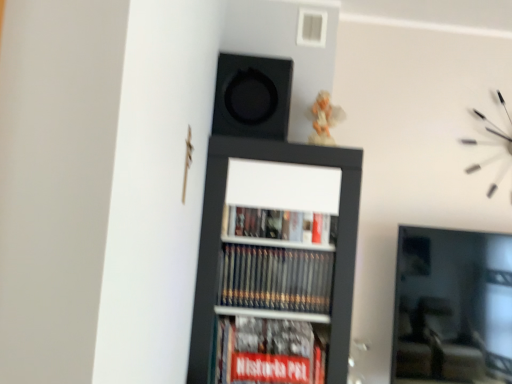
Measure the distance between point (501, 146) and camera.

A distance of 2.11 meters exists between point (501, 146) and camera.

The image size is (512, 384). In order to click on black matte speaker at upper center in this screenshot , I will do `click(252, 96)`.

What do you see at coordinates (275, 261) in the screenshot?
I see `black matte bookcase at center` at bounding box center [275, 261].

Identify the location of white matte clock at upper right. The width and height of the screenshot is (512, 384). (495, 144).

From the image's perspective, is white matte clock at upper right located above or below black matte bookcase at center?

white matte clock at upper right is above black matte bookcase at center.

Which is more to the left, white matte clock at upper right or black matte bookcase at center?

black matte bookcase at center.

Which of these two, white matte clock at upper right or black matte bookcase at center, stands taller?

black matte bookcase at center is taller.

Can you confirm if black matte speaker at upper center is positioned to the right of white matte clock at upper right?

No, black matte speaker at upper center is not to the right of white matte clock at upper right.

Choose the correct answer: Is black matte speaker at upper center inside white matte clock at upper right or outside it?

black matte speaker at upper center is spatially situated outside white matte clock at upper right.

Between black matte speaker at upper center and white matte clock at upper right, which one has larger size?

black matte speaker at upper center is bigger.

From the image's perspective, which one is positioned higher, black matte speaker at upper center or white matte clock at upper right?

black matte speaker at upper center is shown above in the image.

Are white matte clock at upper right and black matte speaker at upper center far apart?

Indeed, white matte clock at upper right is not near black matte speaker at upper center.

From the picture: Who is shorter, white matte clock at upper right or black matte speaker at upper center?

With less height is black matte speaker at upper center.

From a real-world perspective, is white matte clock at upper right physically below black matte speaker at upper center?

Yes, from a real-world perspective, white matte clock at upper right is below black matte speaker at upper center.

Is point (487, 125) farther from camera compared to point (250, 106)?

Yes, point (487, 125) is farther from viewer.

Is white matte clock at upper right located within black matte bookcase at center?

No, white matte clock at upper right is not inside black matte bookcase at center.

Is black matte bookcase at center smaller than white matte clock at upper right?

Incorrect, black matte bookcase at center is not smaller in size than white matte clock at upper right.

Measure the distance from black matte bookcase at center to white matte clock at upper right.

black matte bookcase at center is 1.09 meters away from white matte clock at upper right.

What's the angular difference between black matte bookcase at center and white matte clock at upper right's facing directions?

The angular difference between black matte bookcase at center and white matte clock at upper right is 0.149 degrees.

From a real-world perspective, who is located higher, black matte speaker at upper center or black matte bookcase at center?

In real-world perspective, black matte speaker at upper center is above.

Is point (285, 100) farther from viewer compared to point (266, 151)?

That is True.

From the picture: Does black matte speaker at upper center turn towards black matte bookcase at center?

No, black matte speaker at upper center is not turned towards black matte bookcase at center.

Find the location of `bookcase on the right of black matte speaker at upper center`. bookcase on the right of black matte speaker at upper center is located at coordinates (275, 261).

Is black matte bookcase at center far from black matte speaker at upper center?

Actually, black matte bookcase at center and black matte speaker at upper center are a little close together.

Looking at this image, could you tell me if black matte bookcase at center is facing black matte speaker at upper center?

No, black matte bookcase at center is not aimed at black matte speaker at upper center.

How many degrees apart are the facing directions of black matte bookcase at center and black matte speaker at upper center?

There is a 1.29-degree angle between the facing directions of black matte bookcase at center and black matte speaker at upper center.

Which is correct: black matte bookcase at center is inside black matte speaker at upper center, or outside of it?

black matte bookcase at center is spatially situated outside black matte speaker at upper center.

You are a GUI agent. You are given a task and a screenshot of the screen. Output one action in this format:
    pyautogui.click(x=<x>, y=<y>)
    Task: Click on the clock that appears above the black matte bookcase at center (from a real-world perspective)
    
    Given the screenshot: What is the action you would take?
    pyautogui.click(x=495, y=144)

Locate an element on the screen. The height and width of the screenshot is (384, 512). speaker on the left side of white matte clock at upper right is located at coordinates (252, 96).

Considering their positions, is black matte bookcase at center positioned further to black matte speaker at upper center than white matte clock at upper right?

white matte clock at upper right lies further to black matte speaker at upper center than the other object.

Considering their positions, is white matte clock at upper right positioned further to black matte bookcase at center than black matte speaker at upper center?

The object further to black matte bookcase at center is white matte clock at upper right.

When comparing their distances from white matte clock at upper right, does black matte bookcase at center or black matte speaker at upper center seem closer?

black matte bookcase at center is closer to white matte clock at upper right.

When comparing their distances from black matte speaker at upper center, does white matte clock at upper right or black matte bookcase at center seem closer?

The object closer to black matte speaker at upper center is black matte bookcase at center.

Based on their spatial positions, is black matte speaker at upper center or black matte bookcase at center further from white matte clock at upper right?

black matte speaker at upper center is further to white matte clock at upper right.

Considering their positions, is black matte speaker at upper center positioned further to black matte bookcase at center than white matte clock at upper right?

Based on the image, white matte clock at upper right appears to be further to black matte bookcase at center.

Identify the location of bookcase situated between black matte speaker at upper center and white matte clock at upper right from left to right. This screenshot has width=512, height=384. 275,261.